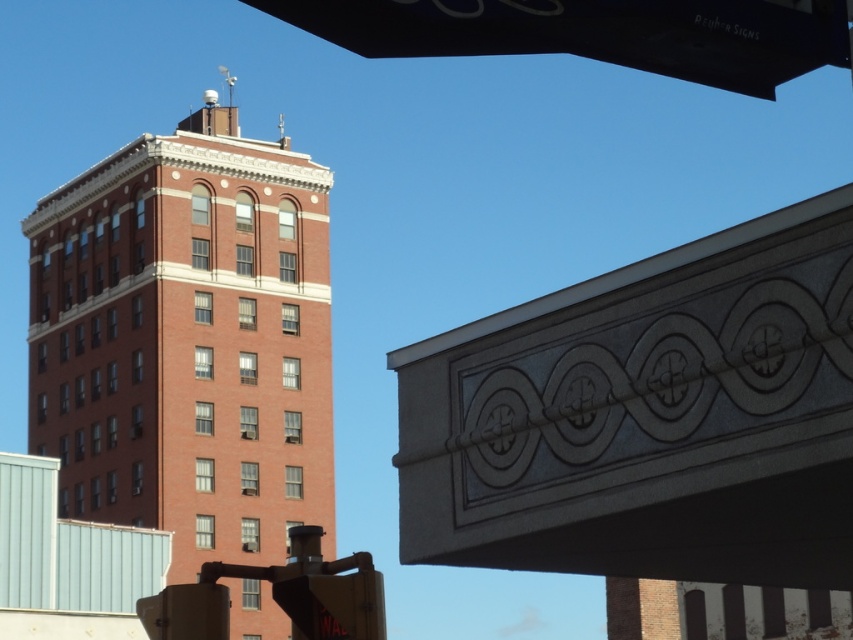
Identify the location of metallic yellow traffic light at lower center. (334, 605).

Is metallic yellow traffic light at lower center above metallic traffic light at lower left?

Correct, metallic yellow traffic light at lower center is located above metallic traffic light at lower left.

Is point (372, 600) closer to viewer compared to point (173, 621)?

No, (372, 600) is behind (173, 621).

The width and height of the screenshot is (853, 640). I want to click on metallic yellow traffic light at lower center, so click(334, 605).

Between brick building at left and metallic yellow traffic light at lower center, which one is positioned lower?

metallic yellow traffic light at lower center

This screenshot has height=640, width=853. What are the coordinates of `brick building at left` in the screenshot? It's located at (187, 340).

Does black plastic street sign at upper center appear under metallic traffic light at lower left?

Actually, black plastic street sign at upper center is above metallic traffic light at lower left.

Who is higher up, black plastic street sign at upper center or metallic traffic light at lower left?

Positioned higher is black plastic street sign at upper center.

Find the location of `black plastic street sign at upper center`. black plastic street sign at upper center is located at coordinates (596, 33).